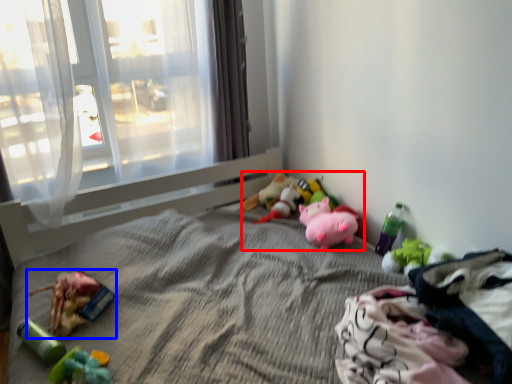
Question: Among these objects, which one is nearest to the camera, toy (highlighted by a red box) or toy (highlighted by a blue box)?

Choices:
 (A) toy
 (B) toy

Answer: (B)